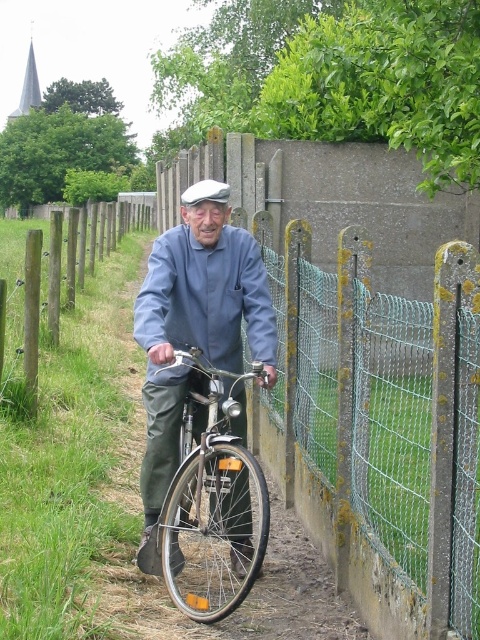
Is matte blue bicycle at center taller than shiny silver bicycle at center?

Correct, matte blue bicycle at center is much taller as shiny silver bicycle at center.

Measure the distance between point (121, 572) and camera.

15.83 feet

This screenshot has width=480, height=640. What do you see at coordinates (245, 600) in the screenshot? I see `matte blue bicycle at center` at bounding box center [245, 600].

Find the location of `matte blue bicycle at center`. matte blue bicycle at center is located at coordinates (245, 600).

Who is positioned more to the left, matte blue shirt at center or shiny silver bicycle at center?

matte blue shirt at center is more to the left.

Can you confirm if matte blue shirt at center is wider than shiny silver bicycle at center?

Indeed, matte blue shirt at center has a greater width compared to shiny silver bicycle at center.

Who is more forward, [243,492] or [168,573]?

Point [168,573]

Locate an element on the screen. matte blue shirt at center is located at coordinates (194, 328).

Who is taller, matte blue shirt at center or matte blue bicycle at center?

matte blue shirt at center is taller.

Does matte blue shirt at center have a lesser height compared to matte blue bicycle at center?

Incorrect, matte blue shirt at center's height does not fall short of matte blue bicycle at center's.

Is point (180, 554) positioned before point (121, 385)?

Yes, it is.

Locate an element on the screen. matte blue shirt at center is located at coordinates (194, 328).